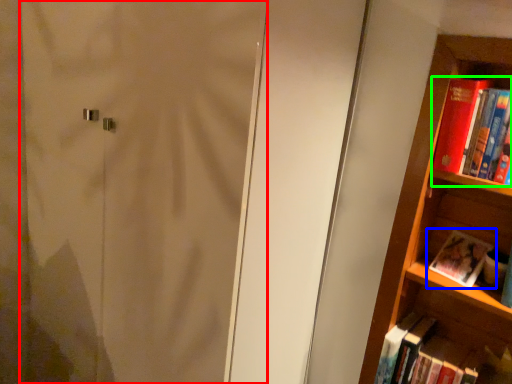
Question: Based on their relative distances, which object is farther from screen door (highlighted by a red box)? Choose from book (highlighted by a blue box) and book (highlighted by a green box).

Choices:
 (A) book
 (B) book

Answer: (A)